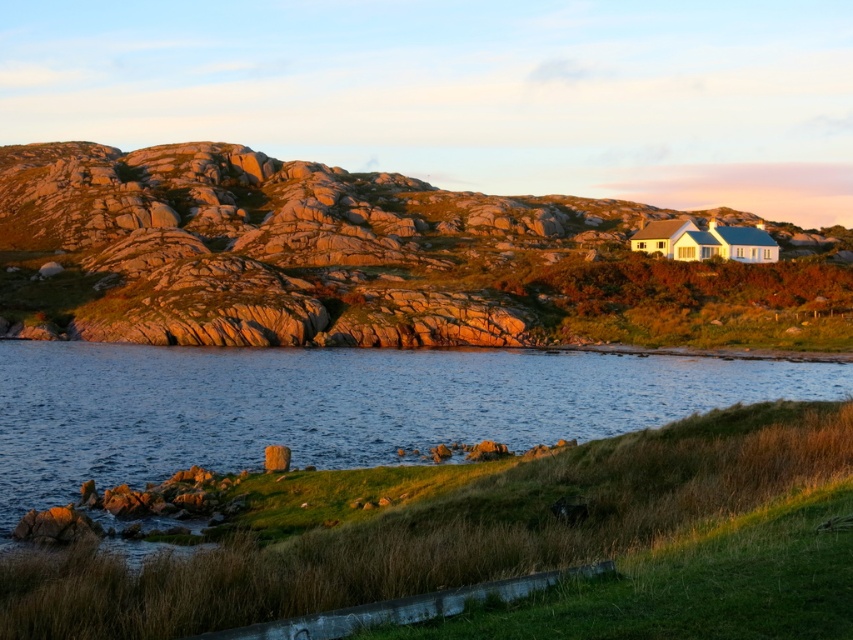
Is rough stone hillside at upper center in front of smooth gray rock at lower left?

No.

Is rough stone hillside at upper center smaller than smooth gray rock at lower left?

Incorrect, rough stone hillside at upper center is not smaller in size than smooth gray rock at lower left.

Describe the element at coordinates (379, 259) in the screenshot. I see `rough stone hillside at upper center` at that location.

This screenshot has width=853, height=640. Find the location of `rough stone hillside at upper center`. rough stone hillside at upper center is located at coordinates (379, 259).

Which is below, blue water at center or smooth gray rock at lower left?

smooth gray rock at lower left is lower down.

Which is more to the left, blue water at center or smooth gray rock at lower left?

Positioned to the left is blue water at center.

You are a GUI agent. You are given a task and a screenshot of the screen. Output one action in this format:
    pyautogui.click(x=<x>, y=<y>)
    Task: Click on the blue water at center
    
    Given the screenshot: What is the action you would take?
    pyautogui.click(x=332, y=404)

Does rough stone hillside at upper center appear on the left side of blue water at center?

Indeed, rough stone hillside at upper center is positioned on the left side of blue water at center.

Which is more to the left, rough stone hillside at upper center or blue water at center?

rough stone hillside at upper center is more to the left.

Is point (74, 252) positioned after point (33, 365)?

Yes, it is behind point (33, 365).

You are a GUI agent. You are given a task and a screenshot of the screen. Output one action in this format:
    pyautogui.click(x=<x>, y=<y>)
    Task: Click on the rough stone hillside at upper center
    
    Given the screenshot: What is the action you would take?
    pyautogui.click(x=379, y=259)